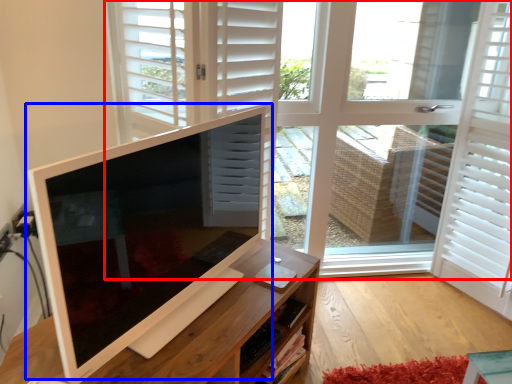
Question: Among these objects, which one is nearest to the camera, window (highlighted by a red box) or computer monitor (highlighted by a blue box)?

Choices:
 (A) window
 (B) computer monitor

Answer: (B)